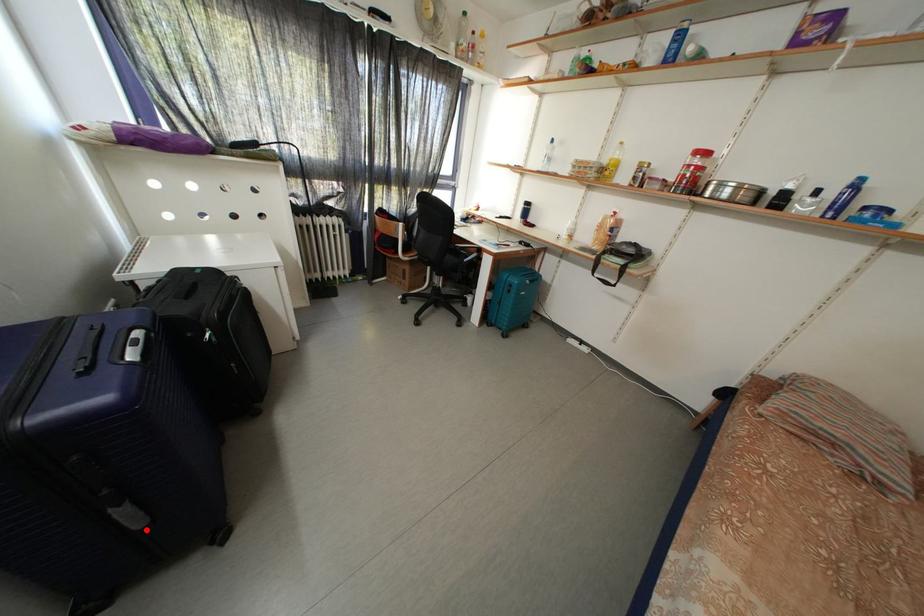
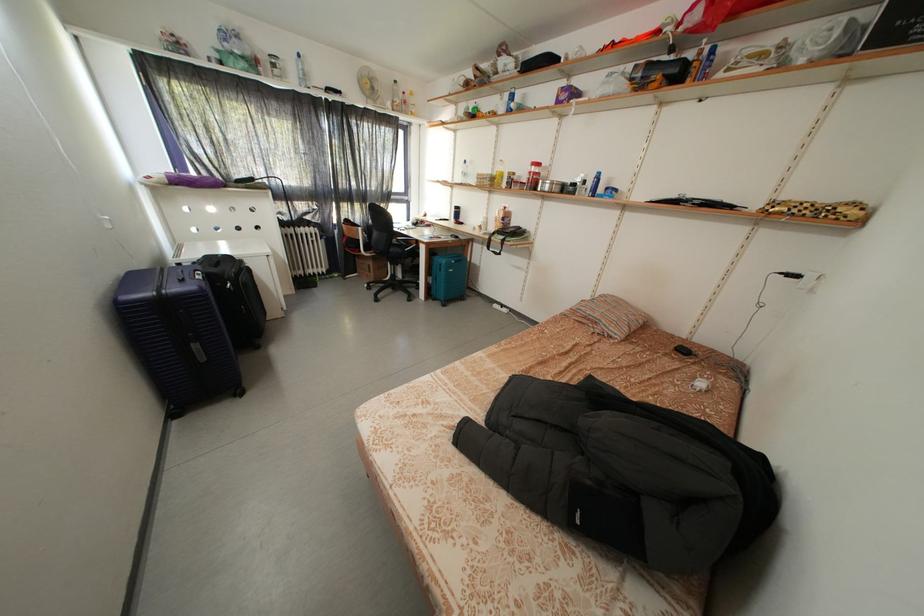
Question: I am providing you with two images of the same scene from different viewpoints. A red point is shown in image1. For the corresponding object point in image2, is it positioned nearer or farther from the camera?

Choices:
 (A) Nearer
 (B) Farther

Answer: (B)